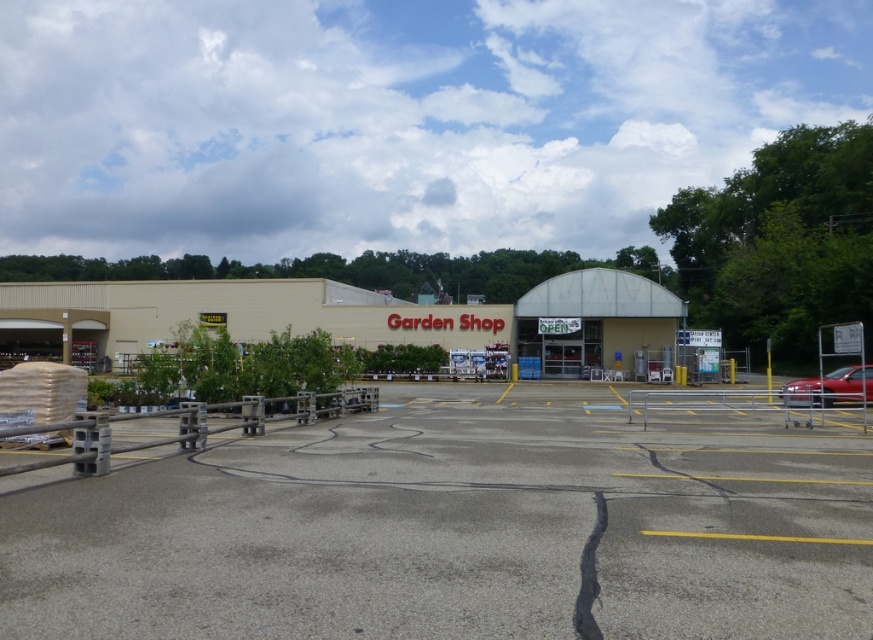
Is point (308, 476) positioned in front of point (155, 346)?

Yes, point (308, 476) is closer to viewer.

Does gray concrete parking lot at lower left have a lesser height compared to beige/textured building at center?

Correct, gray concrete parking lot at lower left is not as tall as beige/textured building at center.

Locate an element on the screen. This screenshot has height=640, width=873. gray concrete parking lot at lower left is located at coordinates (458, 528).

Between gray concrete parking lot at lower left and metallic silver awning at center, which one is positioned higher?

Positioned higher is metallic silver awning at center.

Does gray concrete parking lot at lower left appear on the right side of metallic silver awning at center?

Incorrect, gray concrete parking lot at lower left is not on the right side of metallic silver awning at center.

Locate an element on the screen. gray concrete parking lot at lower left is located at coordinates (458, 528).

Does beige/textured building at center appear on the right side of metallic silver awning at center?

In fact, beige/textured building at center is to the left of metallic silver awning at center.

Can you confirm if beige/textured building at center is thinner than metallic silver awning at center?

No.

The height and width of the screenshot is (640, 873). I want to click on beige/textured building at center, so click(342, 317).

Identify the location of beige/textured building at center. (342, 317).